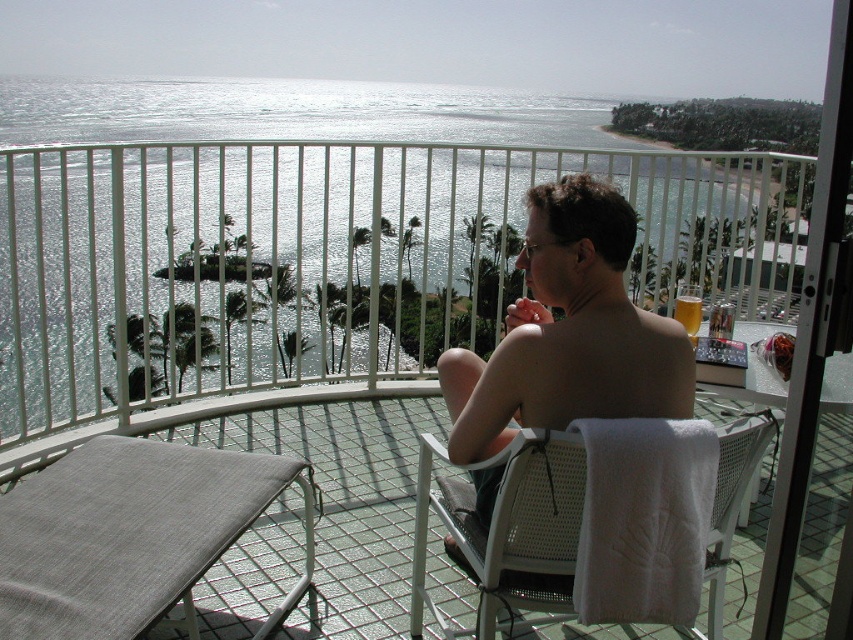
You are a visitor on the balcony and want to place your phone on the surface nearest to you. Which object between the gray fabric chair at lower left and the translucent glass beverage at upper right is taller, making it a better option for placing your phone?

The gray fabric chair at lower left is taller than the translucent glass beverage at upper right, so placing the phone on the chair might be more stable.

You are a delivery robot that needs to place a small package on the shiny silver phone at center without knocking over the translucent glass beverage at upper right. Given that the minimum safe distance for placing objects near a glass is 18 inches, can you safely place the package?

The shiny silver phone at center is 22.20 inches from the translucent glass beverage at upper right. Since the required minimum safe distance is 18 inches, the distance is sufficient. Therefore, you can safely place the package on the shiny silver phone at center without risking the beverage.